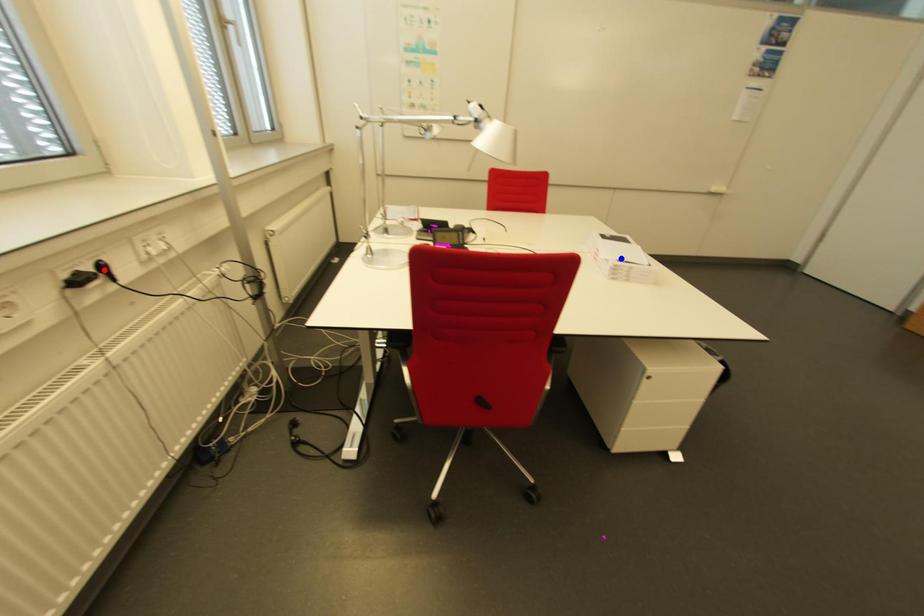
Question: In the image, two points are highlighted. Which point is nearer to the camera? Reply with the corresponding letter.

Choices:
 (A) blue point
 (B) red point

Answer: (B)